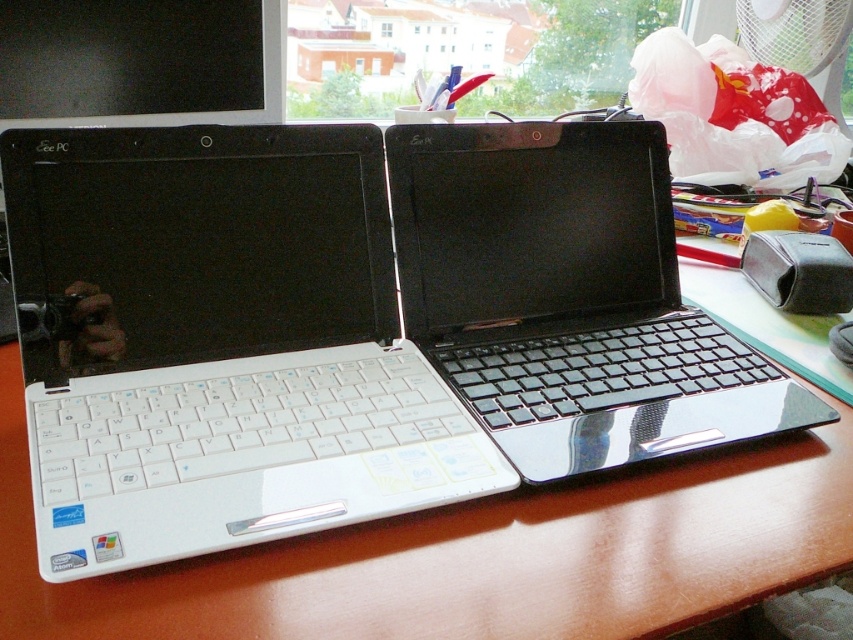
Question: Which object is positioned closest to the glossy black laptop at center?

Choices:
 (A) wooden at center
 (B) white glossy laptop at left

Answer: (B)

Question: Where is wooden at center located in relation to glossy black laptop at center in the image?

Choices:
 (A) below
 (B) above

Answer: (A)

Question: Estimate the real-world distances between objects in this image. Which object is closer to the glossy black laptop at center?

Choices:
 (A) white glossy laptop at left
 (B) wooden at center

Answer: (A)

Question: Which object is farther from the camera taking this photo?

Choices:
 (A) glossy black laptop at center
 (B) wooden at center

Answer: (A)

Question: Considering the relative positions of wooden at center and glossy black laptop at center in the image provided, where is wooden at center located with respect to glossy black laptop at center?

Choices:
 (A) right
 (B) left

Answer: (B)

Question: Is white glossy laptop at left thinner than wooden at center?

Choices:
 (A) no
 (B) yes

Answer: (B)